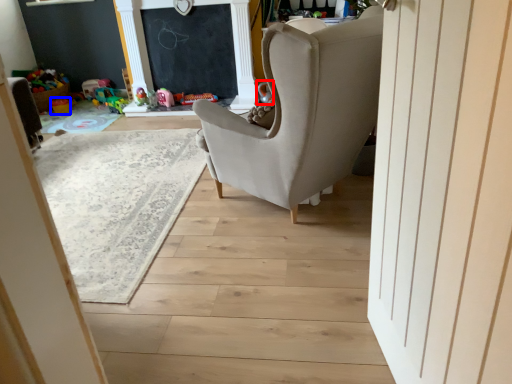
Question: Which of the following is the farthest to the observer, toy (highlighted by a red box) or toy (highlighted by a blue box)?

Choices:
 (A) toy
 (B) toy

Answer: (B)